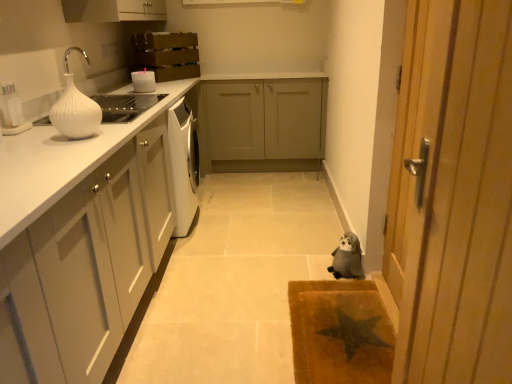
Image resolution: width=512 pixels, height=384 pixels. Describe the element at coordinates (167, 54) in the screenshot. I see `wooden crate at upper center, the 2th cabinetry in the back-to-front sequence` at that location.

The height and width of the screenshot is (384, 512). Describe the element at coordinates (143, 81) in the screenshot. I see `white glossy candle at upper center, the 2th appliance in the left-to-right sequence` at that location.

Measure the distance between point (90, 197) and camera.

The depth of point (90, 197) is 1.44 meters.

Image resolution: width=512 pixels, height=384 pixels. Describe the element at coordinates (61, 162) in the screenshot. I see `white glossy countertop at left` at that location.

The image size is (512, 384). In order to click on white glossy knife block at upper left, which ranks as the 1th appliance in front-to-back order in this screenshot , I will do `click(12, 111)`.

At what (x,y) coordinates should I click in order to perform the action: click on matte gray cabinets at center, the third cabinetry viewed from the front. Please return your answer as a coordinate pair (x, y). The image size is (512, 384). Looking at the image, I should click on (262, 121).

Based on the photo, which object is positioned more to the right, beige textured mat at lower right or white glossy vase at upper left?

beige textured mat at lower right is more to the right.

Is beige textured mat at lower right directly adjacent to white glossy vase at upper left?

No, beige textured mat at lower right is not beside white glossy vase at upper left.

Consider the image. Between beige textured mat at lower right and white glossy vase at upper left, which one is positioned behind?

white glossy vase at upper left is more distant.

Looking at the image, does beige textured mat at lower right seem bigger or smaller compared to white glossy vase at upper left?

beige textured mat at lower right is bigger than white glossy vase at upper left.

Based on the photo, can you tell me how much beige textured mat at lower right and matte gray cabinets at center, the 1th cabinetry when ordered from back to front, differ in facing direction?

89.6 degrees separate the facing orientations of beige textured mat at lower right and matte gray cabinets at center, the 1th cabinetry when ordered from back to front.

Could you tell me if beige textured mat at lower right is turned towards matte gray cabinets at center, the third cabinetry viewed from the front?

No, beige textured mat at lower right is not turned towards matte gray cabinets at center, the third cabinetry viewed from the front.

Is matte gray cabinets at center, the third cabinetry viewed from the front, completely or partially inside beige textured mat at lower right?

Definitely not — matte gray cabinets at center, the third cabinetry viewed from the front, is not inside beige textured mat at lower right.

Would you say beige textured mat at lower right is a long distance from matte gray cabinets at center, the third cabinetry viewed from the front?

beige textured mat at lower right is positioned a significant distance from matte gray cabinets at center, the third cabinetry viewed from the front.

Which object is further away from the camera, wooden door at right or white matte cabinet at left, the 3th cabinetry viewed from the back?

white matte cabinet at left, the 3th cabinetry viewed from the back.

Could you tell me if wooden door at right is facing white matte cabinet at left, the 3th cabinetry viewed from the back?

Yes.

Which of these two, wooden door at right or white matte cabinet at left, acting as the 1th cabinetry starting from the front, stands taller?

wooden door at right is taller.

From the image's perspective, which object appears higher, wooden door at right or white matte cabinet at left, the 3th cabinetry viewed from the back?

From the image's view, wooden door at right is above.

Could you tell me if white glossy candle at upper center, the second appliance when ordered from bottom to top, is facing wooden door at right?

No, white glossy candle at upper center, the second appliance when ordered from bottom to top, is not turned towards wooden door at right.

Considering the sizes of objects white glossy candle at upper center, the first appliance in the right-to-left sequence, and wooden door at right in the image provided, who is shorter, white glossy candle at upper center, the first appliance in the right-to-left sequence, or wooden door at right?

white glossy candle at upper center, the first appliance in the right-to-left sequence.

Is white glossy candle at upper center, the first appliance in the right-to-left sequence, outside of wooden door at right?

Yes.

Can you confirm if white ribbed vase at left is wider than wooden crate at upper center, which appears as the second cabinetry when viewed from the front?

Incorrect, the width of white ribbed vase at left does not surpass that of wooden crate at upper center, which appears as the second cabinetry when viewed from the front.

Can you confirm if white ribbed vase at left is taller than wooden crate at upper center, the 2th cabinetry in the back-to-front sequence?

No.

Is white ribbed vase at left far away from wooden crate at upper center, which appears as the second cabinetry when viewed from the front?

Yes, white ribbed vase at left and wooden crate at upper center, which appears as the second cabinetry when viewed from the front, are quite far apart.

Can you tell me how much white ribbed vase at left and wooden crate at upper center, the 2th cabinetry in the back-to-front sequence, differ in facing direction?

The angular difference between white ribbed vase at left and wooden crate at upper center, the 2th cabinetry in the back-to-front sequence, is 40 degrees.

Looking at the image, does matte gray cabinets at center, the 1th cabinetry when ordered from back to front, seem bigger or smaller compared to white glossy vase at upper left?

In the image, matte gray cabinets at center, the 1th cabinetry when ordered from back to front, appears to be larger than white glossy vase at upper left.

Are matte gray cabinets at center, the third cabinetry viewed from the front, and white glossy vase at upper left far apart?

Yes, matte gray cabinets at center, the third cabinetry viewed from the front, and white glossy vase at upper left are quite far apart.

Which of these two, matte gray cabinets at center, the 1th cabinetry when ordered from back to front, or white glossy vase at upper left, is thinner?

Thinner between the two is white glossy vase at upper left.

From a real-world perspective, is white glossy countertop at left located higher than fluffy gray stuffed animal at lower right?

Yes, from a real-world perspective, white glossy countertop at left is above fluffy gray stuffed animal at lower right.

How many degrees apart are the facing directions of white glossy countertop at left and fluffy gray stuffed animal at lower right?

161 degrees separate the facing orientations of white glossy countertop at left and fluffy gray stuffed animal at lower right.

Is white glossy countertop at left not near fluffy gray stuffed animal at lower right?

white glossy countertop at left is positioned a significant distance from fluffy gray stuffed animal at lower right.

You are a GUI agent. You are given a task and a screenshot of the screen. Output one action in this format:
    pyautogui.click(x=<x>, y=<y>)
    Task: Click on the countertop above the fluffy gray stuffed animal at lower right (from the image's perspective)
    
    Given the screenshot: What is the action you would take?
    pyautogui.click(x=61, y=162)

This screenshot has height=384, width=512. Find the location of `sink behind the beige textured mat at lower right`. sink behind the beige textured mat at lower right is located at coordinates (93, 107).

Locate an element on the screen. the 1st cabinetry to the left of the beige textured mat at lower right, counting from the anchor's position is located at coordinates (262, 121).

Looking at the image, which one is located further to wooden door at right, fluffy gray stuffed animal at lower right or white glossy countertop at left?

fluffy gray stuffed animal at lower right is further to wooden door at right.

Estimate the real-world distances between objects in this image. Which object is further from fluffy gray stuffed animal at lower right, beige textured mat at lower right or white glossy vase at upper left?

white glossy vase at upper left is positioned further to the anchor fluffy gray stuffed animal at lower right.

Based on their spatial positions, is white glossy countertop at left or matte gray cabinets at center, the third cabinetry viewed from the front, closer to wooden door at right?

Among the two, white glossy countertop at left is located nearer to wooden door at right.

Which object lies further to the anchor point white glossy vase at upper left, white ribbed vase at left or wooden crate at upper center, the 2th cabinetry in the back-to-front sequence?

Based on the image, white ribbed vase at left appears to be further to white glossy vase at upper left.

Looking at the image, which one is located closer to beige textured mat at lower right, matte gray cabinets at center, the 1th cabinetry when ordered from back to front, or white glossy knife block at upper left, positioned as the second appliance in back-to-front order?

white glossy knife block at upper left, positioned as the second appliance in back-to-front order, is positioned closer to the anchor beige textured mat at lower right.

Considering their positions, is white ribbed vase at left positioned further to wooden door at right than fluffy gray stuffed animal at lower right?

white ribbed vase at left.

Which object lies nearer to the anchor point white glossy vase at upper left, fluffy gray stuffed animal at lower right or matte gray cabinets at center, the third cabinetry viewed from the front?

The object closer to white glossy vase at upper left is matte gray cabinets at center, the third cabinetry viewed from the front.

Looking at this image, based on their spatial positions, is matte gray cabinets at center, the 1th cabinetry when ordered from back to front, or white matte cabinet at left, acting as the 1th cabinetry starting from the front, closer to white ribbed vase at left?

white matte cabinet at left, acting as the 1th cabinetry starting from the front.

Identify the location of sink positioned between white matte cabinet at left, acting as the 1th cabinetry starting from the front, and white glossy countertop at left from near to far. Image resolution: width=512 pixels, height=384 pixels. (93, 107).

Find the location of a particular element. Image resolution: width=512 pixels, height=384 pixels. countertop between white glossy knife block at upper left, the 1th appliance positioned from the left, and beige textured mat at lower right from left to right is located at coordinates (61, 162).

Locate an element on the screen. The width and height of the screenshot is (512, 384). sink positioned between white ribbed vase at left and white glossy candle at upper center, the second appliance when ordered from bottom to top, from near to far is located at coordinates (93, 107).

The width and height of the screenshot is (512, 384). Identify the location of appliance between wooden door at right and white glossy countertop at left from front to back. (12, 111).